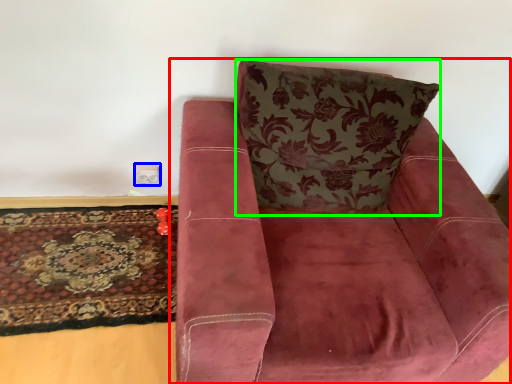
Question: Which object is positioned farthest from chair (highlighted by a red box)? Select from electric outlet (highlighted by a blue box) and throw pillow (highlighted by a green box).

Choices:
 (A) electric outlet
 (B) throw pillow

Answer: (A)